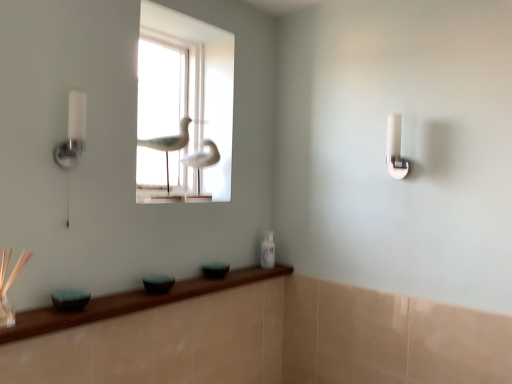
Question: Considering the relative positions of white glossy bottle at lower center and transparent glass door at center in the image provided, is white glossy bottle at lower center behind transparent glass door at center?

Choices:
 (A) no
 (B) yes

Answer: (B)

Question: Is white glossy bottle at lower center at the left side of transparent glass door at center?

Choices:
 (A) no
 (B) yes

Answer: (A)

Question: Is transparent glass door at center located within white glossy bottle at lower center?

Choices:
 (A) no
 (B) yes

Answer: (A)

Question: Is white glossy bottle at lower center oriented away from transparent glass door at center?

Choices:
 (A) no
 (B) yes

Answer: (A)

Question: Could you tell me if white glossy bottle at lower center is facing transparent glass door at center?

Choices:
 (A) yes
 (B) no

Answer: (B)

Question: Based on their positions, is white glossy bottle at lower center located to the left or right of white glossy bird at center, which is the second bird in back-to-front order?

Choices:
 (A) left
 (B) right

Answer: (B)

Question: Is point (263, 241) positioned closer to the camera than point (153, 139)?

Choices:
 (A) closer
 (B) farther

Answer: (A)

Question: From the image's perspective, is white glossy bottle at lower center located above or below white glossy bird at center, placed as the first bird when sorted from front to back?

Choices:
 (A) below
 (B) above

Answer: (A)

Question: In terms of height, does white glossy bottle at lower center look taller or shorter compared to white glossy bird at center, placed as the first bird when sorted from front to back?

Choices:
 (A) short
 (B) tall

Answer: (A)

Question: From the image's perspective, is green glass bowl at lower center, the third glass bowl when ordered from left to right, positioned above or below white glossy bottle at lower center?

Choices:
 (A) below
 (B) above

Answer: (A)

Question: Is green glass bowl at lower center, which is the 1th glass bowl from right to left, inside the boundaries of white glossy bottle at lower center, or outside?

Choices:
 (A) outside
 (B) inside

Answer: (A)

Question: In terms of width, does green glass bowl at lower center, which is the 1th glass bowl from back to front, look wider or thinner when compared to white glossy bottle at lower center?

Choices:
 (A) thin
 (B) wide

Answer: (B)

Question: In the image, is green glass bowl at lower center, the third glass bowl when ordered from left to right, on the left side or the right side of white glossy bottle at lower center?

Choices:
 (A) left
 (B) right

Answer: (A)

Question: Is transparent glass door at center to the left or to the right of white glossy bottle at lower center in the image?

Choices:
 (A) right
 (B) left

Answer: (B)

Question: Would you say transparent glass door at center is inside or outside white glossy bottle at lower center?

Choices:
 (A) inside
 (B) outside

Answer: (B)